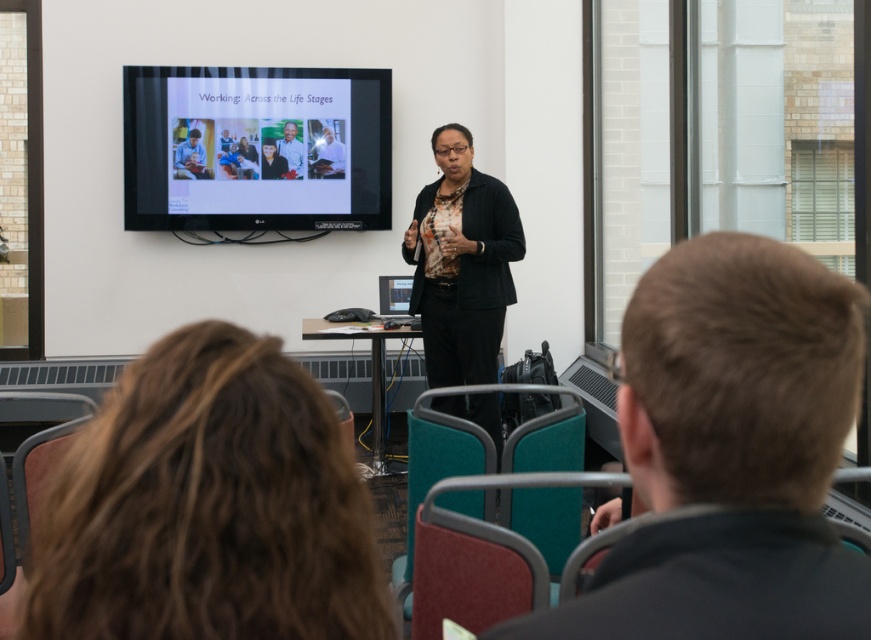
You are an attendee at the presentation and want to see both the dark brown hair at center and the light brown wood frame at center clearly. Which one is positioned lower?

The dark brown hair at center is positioned below the light brown wood frame at center, so it is lower.